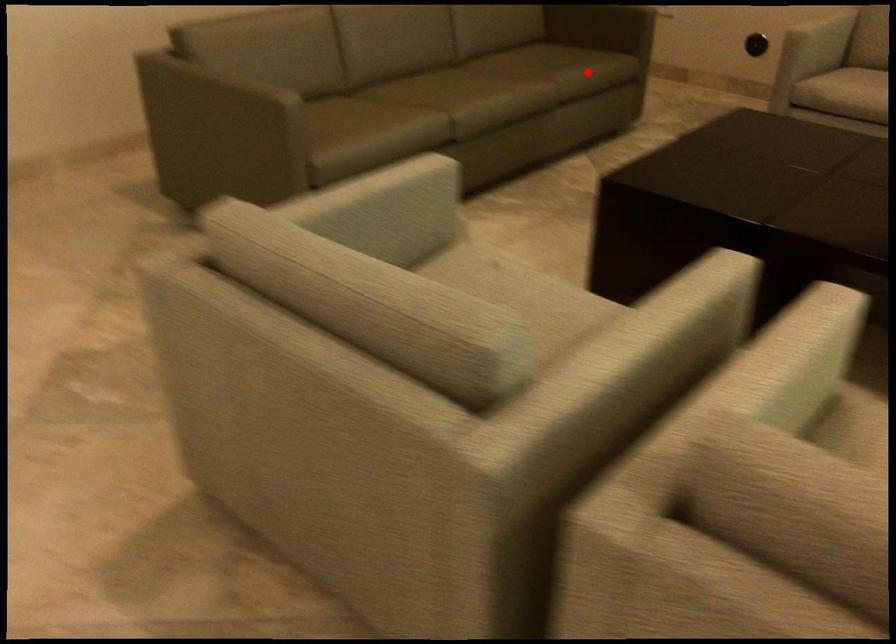
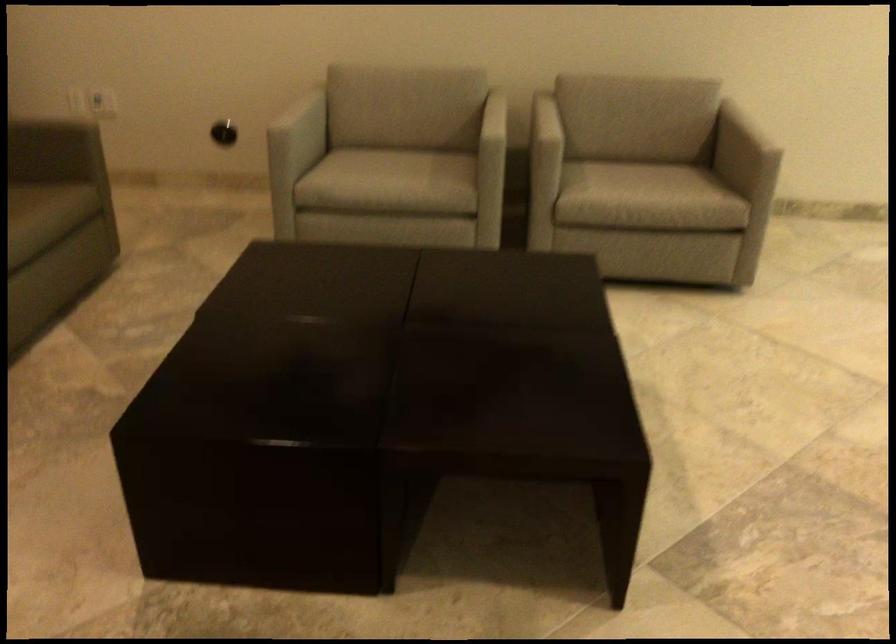
Question: I am providing you with two images of the same scene from different viewpoints. A red point is shown in image1. For the corresponding object point in image2, is it positioned nearer or farther from the camera?

Choices:
 (A) Nearer
 (B) Farther

Answer: (A)